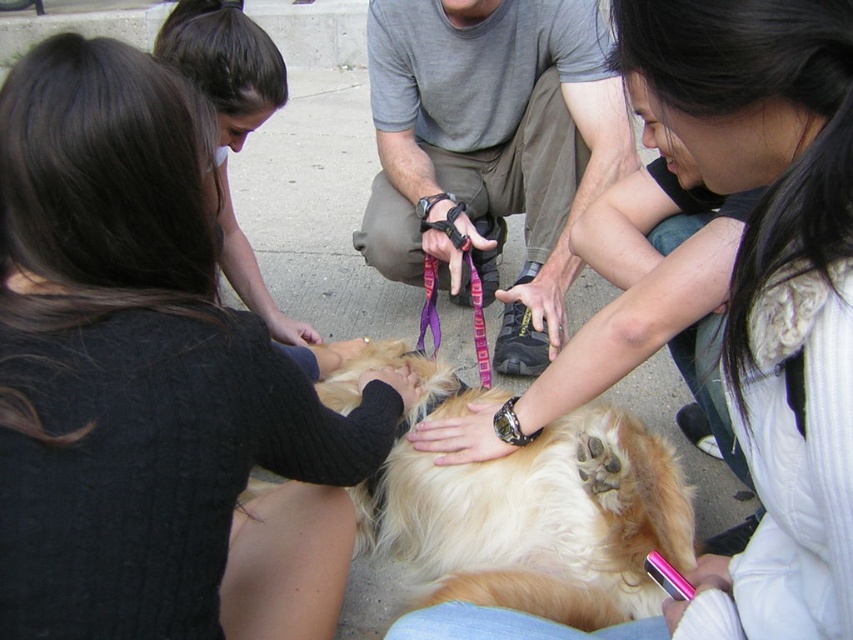
Which of these two, golden fur dog at center or smooth brown hair at upper left, stands shorter?

With less height is golden fur dog at center.

This screenshot has height=640, width=853. What are the coordinates of `golden fur dog at center` in the screenshot? It's located at click(x=537, y=522).

Does fluffy golden fur at center have a smaller size compared to gray cotton shirt at center?

Yes.

Between fluffy golden fur at center and gray cotton shirt at center, which one appears on the left side from the viewer's perspective?

gray cotton shirt at center is more to the left.

Who is more distant from viewer, [704,40] or [386,198]?

Point [386,198]

Locate an element on the screen. fluffy golden fur at center is located at coordinates (755, 307).

Who is shorter, black sweater at center or golden fur dog at center?

With less height is golden fur dog at center.

At what (x,y) coordinates should I click in order to perform the action: click on black sweater at center. Please return your answer as a coordinate pair (x, y). Looking at the image, I should click on (148, 384).